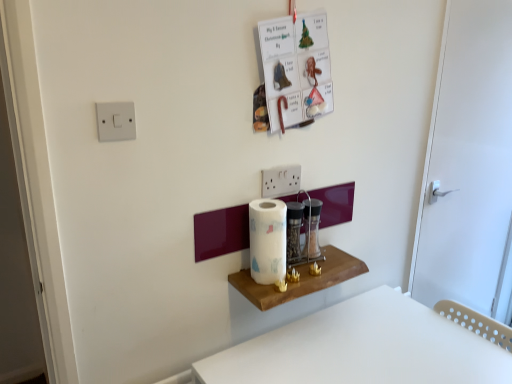
Find the location of a particular element. The width and height of the screenshot is (512, 384). vacant region above wooden shelf at center (from a real-world perspective) is located at coordinates (308, 268).